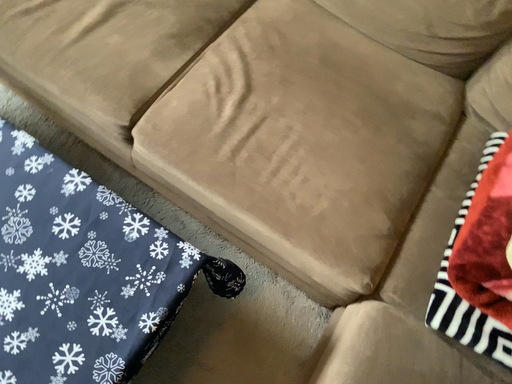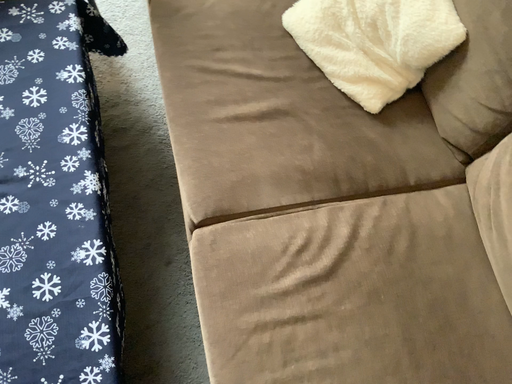
Question: How did the camera likely rotate when shooting the video?

Choices:
 (A) rotated upward
 (B) rotated downward

Answer: (A)